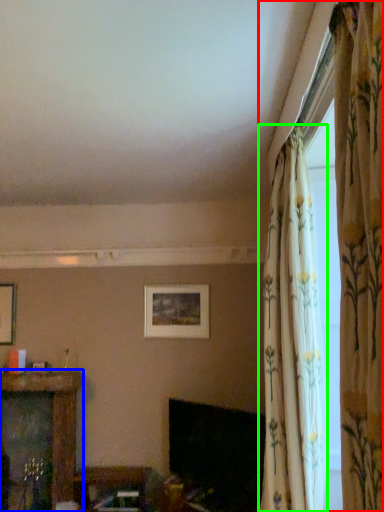
Question: Which object is the closest to the curtain (highlighted by a red box)? Choose among these: furniture (highlighted by a blue box) or curtain (highlighted by a green box).

Choices:
 (A) furniture
 (B) curtain

Answer: (B)